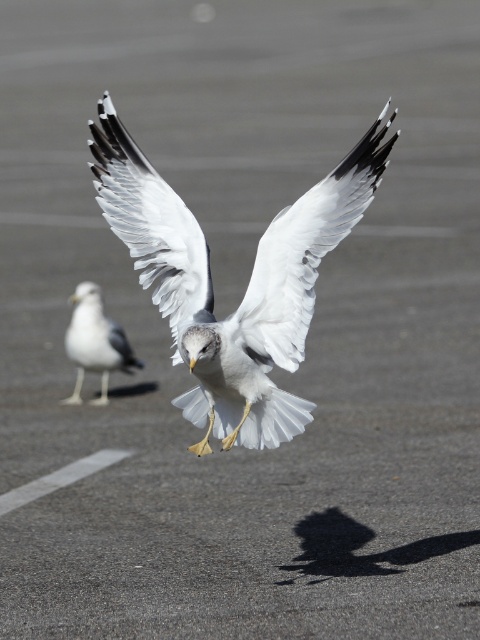
You are a photographer aiming to capture both the white matte wing at center and the white feathered bird at left in a single shot. Based on their positions, which object should you focus on first to ensure both are in frame?

The white matte wing at center is taller than the white feathered bird at left, so focusing on the white matte wing at center first will ensure the white feathered bird at left is also in frame.